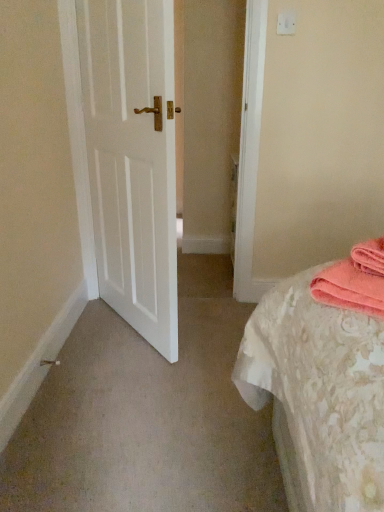
Question: From a real-world perspective, is pink towel at right physically below white plastic light switch at upper center?

Choices:
 (A) yes
 (B) no

Answer: (A)

Question: From the image's perspective, does pink towel at right appear lower than white plastic light switch at upper center?

Choices:
 (A) yes
 (B) no

Answer: (A)

Question: Could white plastic light switch at upper center be considered to be inside pink towel at right?

Choices:
 (A) yes
 (B) no

Answer: (B)

Question: Is pink towel at right further to the viewer compared to white plastic light switch at upper center?

Choices:
 (A) no
 (B) yes

Answer: (A)

Question: Can you confirm if pink towel at right is positioned to the right of white plastic light switch at upper center?

Choices:
 (A) no
 (B) yes

Answer: (B)

Question: Can you confirm if pink towel at right is smaller than white plastic light switch at upper center?

Choices:
 (A) no
 (B) yes

Answer: (A)

Question: Are white plastic light switch at upper center and white matte door at left located far from each other?

Choices:
 (A) yes
 (B) no

Answer: (A)

Question: Is white plastic light switch at upper center positioned in front of white matte door at left?

Choices:
 (A) yes
 (B) no

Answer: (B)

Question: From a real-world perspective, is white plastic light switch at upper center located beneath white matte door at left?

Choices:
 (A) yes
 (B) no

Answer: (B)

Question: From a real-world perspective, is white plastic light switch at upper center located higher than white matte door at left?

Choices:
 (A) no
 (B) yes

Answer: (B)

Question: Is white plastic light switch at upper center positioned beyond the bounds of white matte door at left?

Choices:
 (A) no
 (B) yes

Answer: (B)

Question: Is white plastic light switch at upper center oriented away from white matte door at left?

Choices:
 (A) no
 (B) yes

Answer: (A)

Question: Is the position of white matte door at left less distant than that of pink towel at right?

Choices:
 (A) no
 (B) yes

Answer: (A)